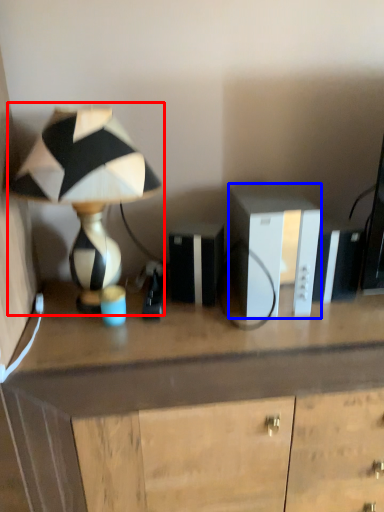
Question: Which point is further to the camera, lamp (highlighted by a red box) or cabinetry (highlighted by a blue box)?

Choices:
 (A) lamp
 (B) cabinetry

Answer: (B)